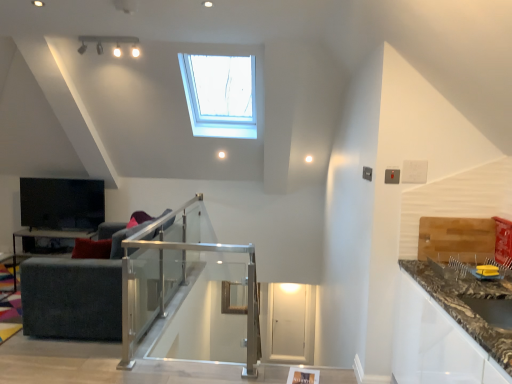
Question: From the image's perspective, is clear glass balustrade at center beneath dark gray fabric couch at left?

Choices:
 (A) yes
 (B) no

Answer: (A)

Question: Is clear glass balustrade at center thinner than dark gray fabric couch at left?

Choices:
 (A) no
 (B) yes

Answer: (B)

Question: Is dark gray fabric couch at left surrounded by clear glass balustrade at center?

Choices:
 (A) yes
 (B) no

Answer: (B)

Question: Is clear glass balustrade at center turned away from dark gray fabric couch at left?

Choices:
 (A) no
 (B) yes

Answer: (B)

Question: Considering the relative sizes of clear glass balustrade at center and dark gray fabric couch at left in the image provided, is clear glass balustrade at center taller than dark gray fabric couch at left?

Choices:
 (A) yes
 (B) no

Answer: (A)

Question: Is dark gray fabric couch at left to the left or to the right of matte black table at lower left in the image?

Choices:
 (A) left
 (B) right

Answer: (B)

Question: From a real-world perspective, is dark gray fabric couch at left positioned above or below matte black table at lower left?

Choices:
 (A) above
 (B) below

Answer: (A)

Question: In terms of width, does dark gray fabric couch at left look wider or thinner when compared to matte black table at lower left?

Choices:
 (A) wide
 (B) thin

Answer: (A)

Question: Is point (112, 276) closer or farther from the camera than point (66, 235)?

Choices:
 (A) farther
 (B) closer

Answer: (B)

Question: Considering their positions, is dark gray fabric couch at left located in front of or behind transparent glass door at center?

Choices:
 (A) behind
 (B) front

Answer: (B)

Question: From the image's perspective, is dark gray fabric couch at left above or below transparent glass door at center?

Choices:
 (A) above
 (B) below

Answer: (A)

Question: Based on their sizes in the image, would you say dark gray fabric couch at left is bigger or smaller than transparent glass door at center?

Choices:
 (A) big
 (B) small

Answer: (A)

Question: From a real-world perspective, is dark gray fabric couch at left above or below transparent glass door at center?

Choices:
 (A) above
 (B) below

Answer: (A)

Question: In terms of height, does clear glass balustrade at center look taller or shorter compared to transparent glass door at center?

Choices:
 (A) short
 (B) tall

Answer: (B)

Question: Is clear glass balustrade at center wider or thinner than transparent glass door at center?

Choices:
 (A) thin
 (B) wide

Answer: (B)